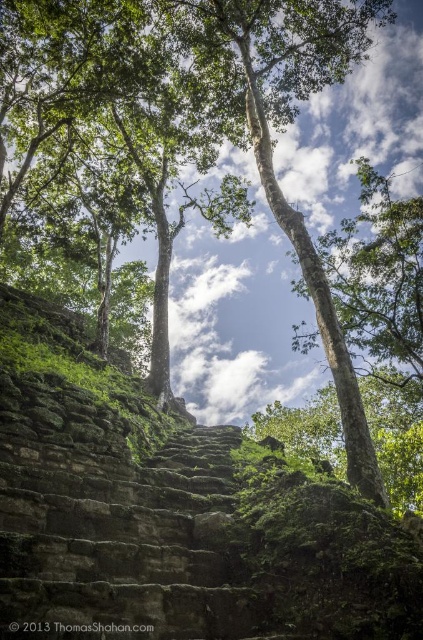
Question: Which point appears closest to the camera in this image?

Choices:
 (A) (123, 445)
 (B) (90, 480)

Answer: (B)

Question: Where is green mossy stone steps at center located in relation to green mossy stone stairs at center in the image?

Choices:
 (A) left
 (B) right

Answer: (A)

Question: Does green mossy stone steps at center appear over green mossy stone stairs at center?

Choices:
 (A) yes
 (B) no

Answer: (A)

Question: Does green mossy stone steps at center have a larger size compared to green mossy stone stairs at center?

Choices:
 (A) no
 (B) yes

Answer: (B)